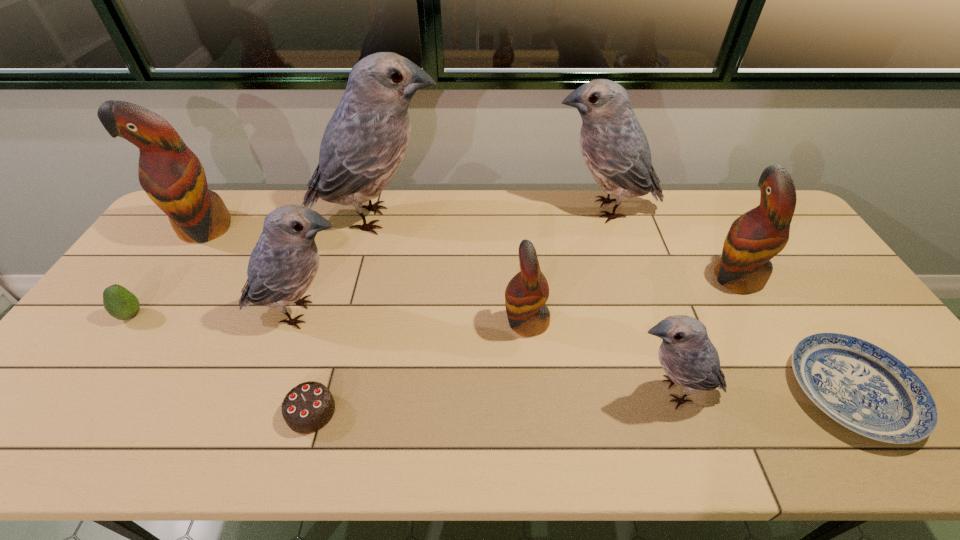
Identify the location of the nearest red parrot. (527, 292).

At what (x,y) coordinates should I click in order to perform the action: click on the second red parrot from left to right. Please return your answer as a coordinate pair (x, y). The height and width of the screenshot is (540, 960). Looking at the image, I should click on (527, 292).

At what (x,y) coordinates should I click in order to perform the action: click on green avocado. Please return your answer as a coordinate pair (x, y). Looking at the image, I should click on (120, 303).

Image resolution: width=960 pixels, height=540 pixels. Find the location of `the third shortest object`. the third shortest object is located at coordinates (120, 303).

Image resolution: width=960 pixels, height=540 pixels. Find the location of `chocolate cake`. chocolate cake is located at coordinates (308, 407).

Image resolution: width=960 pixels, height=540 pixels. I want to click on the ninth tallest object, so click(308, 407).

You are a GUI agent. You are given a task and a screenshot of the screen. Output one action in this format:
    pyautogui.click(x=<x>, y=<y>)
    Task: Click on the blue plate
    The image size is (960, 540).
    Given the screenshot: What is the action you would take?
    pyautogui.click(x=861, y=386)

I want to click on plate, so click(861, 386).

Find the location of a particular element. The height and width of the screenshot is (540, 960). vacant point located 0.070m on the front-facing side of the biggest gray parrot is located at coordinates (467, 219).

This screenshot has height=540, width=960. Identify the location of vacant space located on the front-facing side of the third smallest gray parrot. (447, 210).